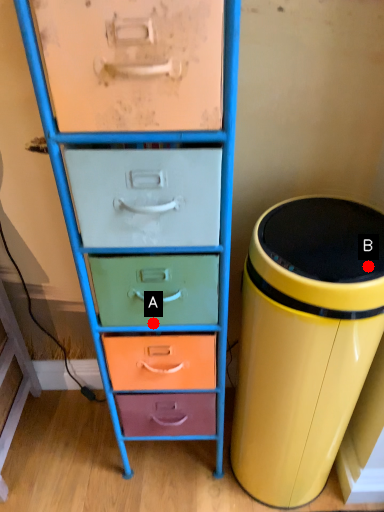
Question: Two points are circled on the image, labeled by A and B beside each circle. Which of the following is the farthest from the observer?

Choices:
 (A) A is further
 (B) B is further

Answer: (A)